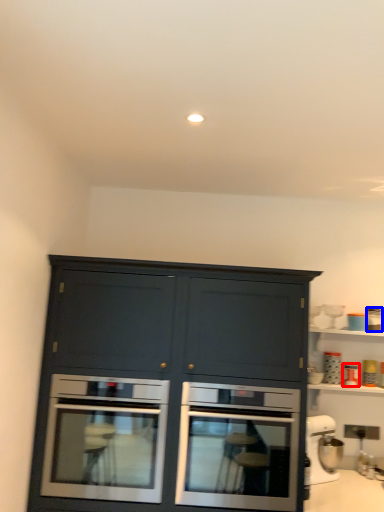
Question: Which object is further to the camera taking this photo, appliance (highlighted by a red box) or appliance (highlighted by a blue box)?

Choices:
 (A) appliance
 (B) appliance

Answer: (B)